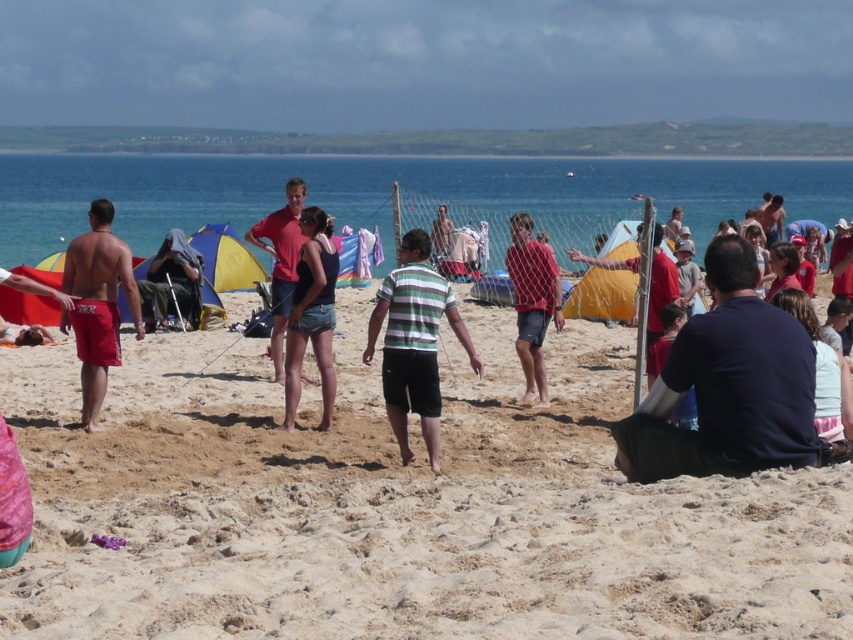
Describe the element at coordinates (97, 305) in the screenshot. I see `matte red shorts at left` at that location.

Does point (134, 284) come behind point (146, 316)?

No, it is in front of (146, 316).

Where is `matte red shorts at left`? The image size is (853, 640). matte red shorts at left is located at coordinates (97, 305).

The width and height of the screenshot is (853, 640). I want to click on matte red shorts at left, so click(x=97, y=305).

Does point (71, 570) come closer to viewer compared to point (96, 260)?

Yes.

Does fine-grained sand at lower center appear on the left side of matte red shorts at left?

In fact, fine-grained sand at lower center is to the right of matte red shorts at left.

Is point (32, 364) closer to camera compared to point (108, 241)?

No, (32, 364) is further to viewer.

Identify the location of fine-grained sand at lower center. The height and width of the screenshot is (640, 853). (396, 506).

Between fine-grained sand at lower center and striped cotton shirt at center, which one is positioned higher?

striped cotton shirt at center is higher up.

Is fine-grained sand at lower center shorter than striped cotton shirt at center?

Yes, fine-grained sand at lower center is shorter than striped cotton shirt at center.

Which is behind, point (291, 516) or point (372, 317)?

Positioned behind is point (372, 317).

Find the location of a particular element. Image resolution: width=853 pixels, height=640 pixels. fine-grained sand at lower center is located at coordinates (396, 506).